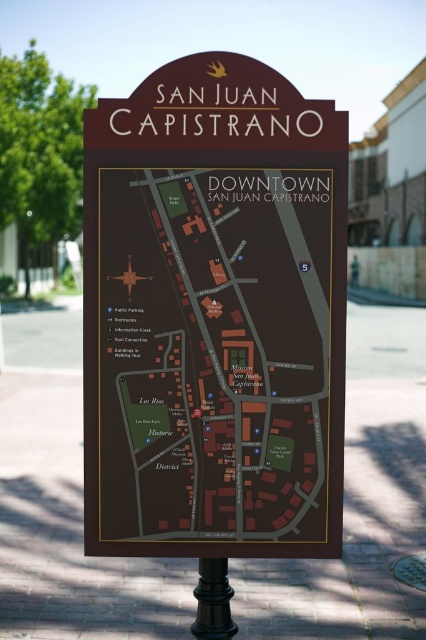
You are a tourist holding a map and want to know the relationship between the dark brown paper map at center and the black polished pole at lower center. Which object is positioned to the left?

The dark brown paper map at center is positioned to the left of the black polished pole at lower center.

In the scene shown: You are a tourist holding a compass that points north. You are facing the dark brown paper map at center displayed on the black polished pole at lower center. According to the map, which direction should you walk to reach the nearest restroom located to the east of the map sign?

The dark brown paper map at center is positioned over the black polished pole at lower center, so you should walk east from the map sign to reach the restroom located to the east.

You are a tourist holding a 1.5 meter tall umbrella. You are standing in front of the dark brown paper map at center and the black polished pole at lower center. Which object can you see the top of without moving your head?

The dark brown paper map at center is much taller than the black polished pole at lower center, so you can see the top of the dark brown paper map at center without moving your head.